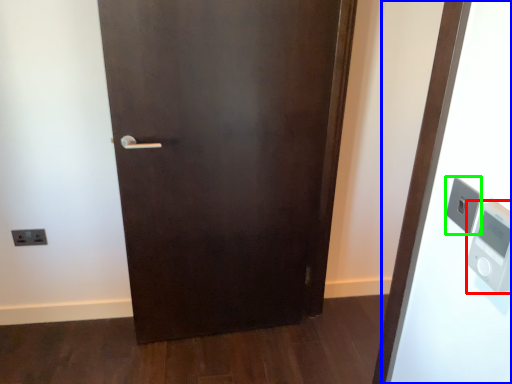
Question: Considering the real-world distances, which object is farthest from thermometer (highlighted by a red box)? elevator (highlighted by a blue box) or light switch (highlighted by a green box)?

Choices:
 (A) elevator
 (B) light switch

Answer: (A)